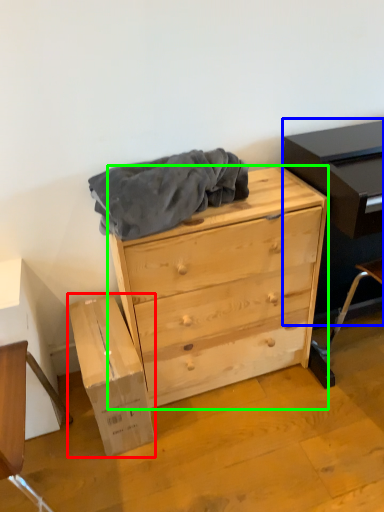
Question: Which object is positioned farthest from cardboard box (highlighted by a red box)? Select from entertainment center (highlighted by a blue box) and chest of drawers (highlighted by a green box).

Choices:
 (A) entertainment center
 (B) chest of drawers

Answer: (A)